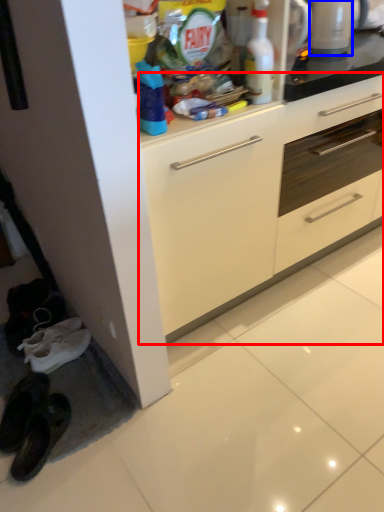
Question: Which object is further to the camera taking this photo, cabinetry (highlighted by a red box) or appliance (highlighted by a blue box)?

Choices:
 (A) cabinetry
 (B) appliance

Answer: (B)